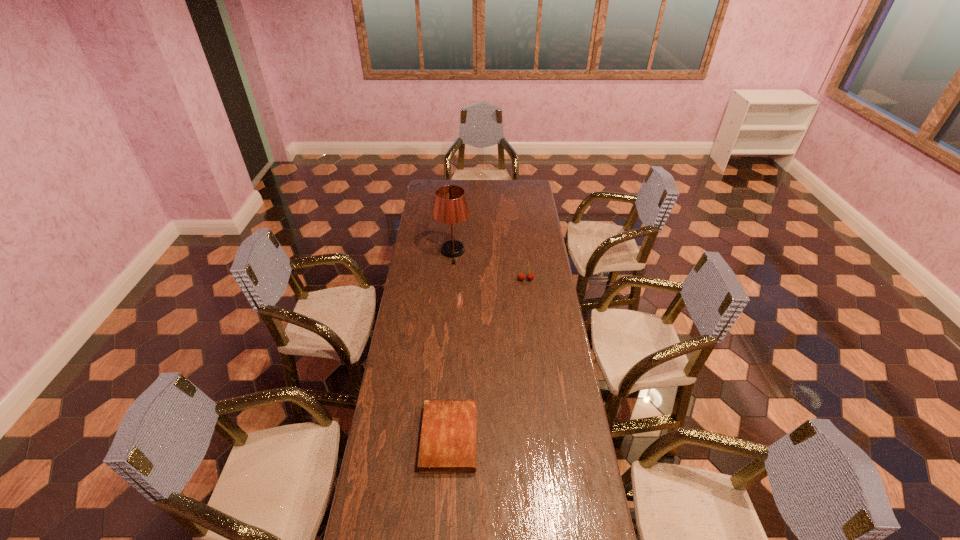
Identify the location of the farthest object. The image size is (960, 540). (450, 206).

I want to click on lampshade, so click(x=450, y=206).

Where is `cherry`? Image resolution: width=960 pixels, height=540 pixels. cherry is located at coordinates (521, 276).

Find the location of a particular element. the rightmost object is located at coordinates [521, 276].

The height and width of the screenshot is (540, 960). Find the location of `Bible`. Bible is located at coordinates (449, 426).

Find the location of a particular element. the nearest object is located at coordinates pos(449,426).

In order to click on blank space located on the front-facing side of the lampshade in this screenshot , I will do `click(450, 289)`.

Image resolution: width=960 pixels, height=540 pixels. I want to click on vacant space located on the surface of the second tallest object, so 533,340.

Where is `vacant space located 0.350m on the spine side of the Bible`? vacant space located 0.350m on the spine side of the Bible is located at coordinates (574, 437).

At what (x,y) coordinates should I click in order to perform the action: click on object present at the left edge. Please return your answer as a coordinate pair (x, y). This screenshot has height=540, width=960. Looking at the image, I should click on (450, 206).